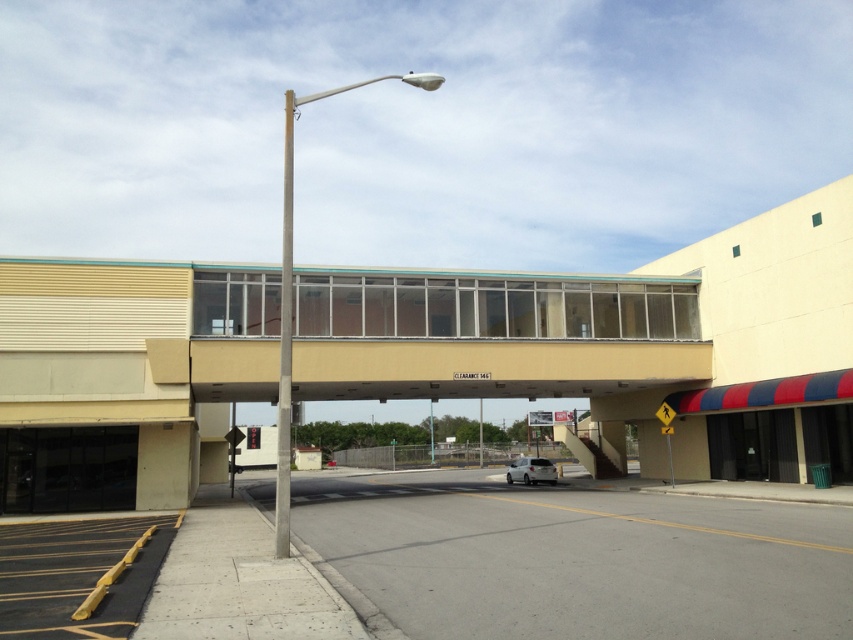
What are the coordinates of the beige matte overpass at center?

The beige matte overpass at center is located at coordinates point (489, 337).

You are a delivery person needing to park your white matte car at center near the silver metallic pole at center. Can you safely maneuver your car to park right next to the pole?

The silver metallic pole at center is closer to the viewer than the white matte car at center, so the car is further away. This means there might be space between them, but since the pole is closer, the car cannot be parked directly next to it without moving closer. Therefore, you cannot safely park the white matte car at center right next to the silver metallic pole at center.